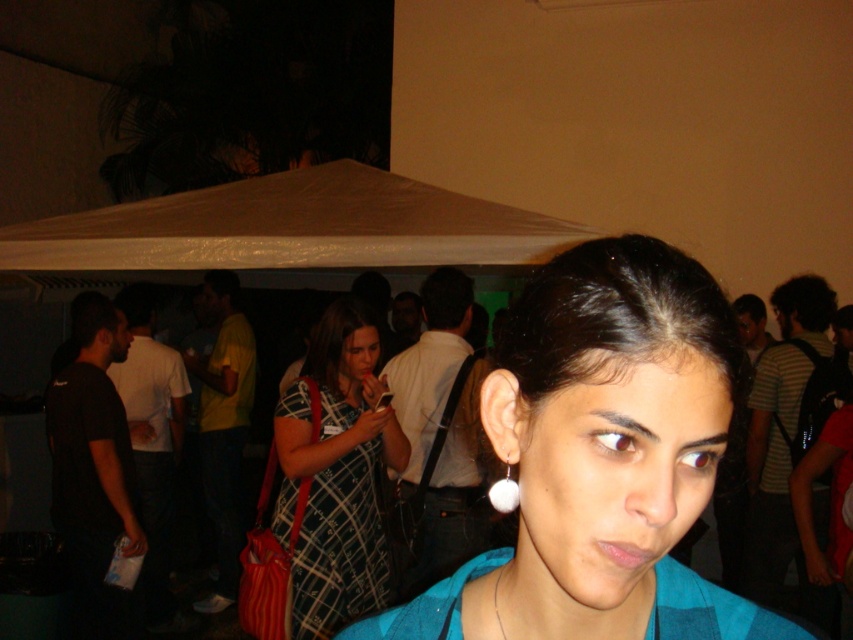
Does plaid fabric dress at center come behind white pearl earring at center?

Yes, plaid fabric dress at center is further from the viewer.

Is point (370, 369) closer to camera compared to point (460, 321)?

Yes.

The height and width of the screenshot is (640, 853). In order to click on plaid fabric dress at center in this screenshot , I will do `click(335, 474)`.

Does point (606, 246) lie in front of point (412, 515)?

Yes, point (606, 246) is in front of point (412, 515).

Describe the element at coordinates (601, 460) in the screenshot. Image resolution: width=853 pixels, height=640 pixels. I see `teal fabric shirt at center` at that location.

Is point (548, 358) more distant than point (440, 346)?

No, it is in front of (440, 346).

This screenshot has width=853, height=640. What are the coordinates of `teal fabric shirt at center` in the screenshot? It's located at (601, 460).

Can you confirm if teal fabric shirt at center is positioned to the right of plaid fabric dress at center?

Indeed, teal fabric shirt at center is positioned on the right side of plaid fabric dress at center.

Between point (637, 584) and point (375, 513), which one is positioned in front?

Point (637, 584)

Find the location of `teal fabric shirt at center`. teal fabric shirt at center is located at coordinates (601, 460).